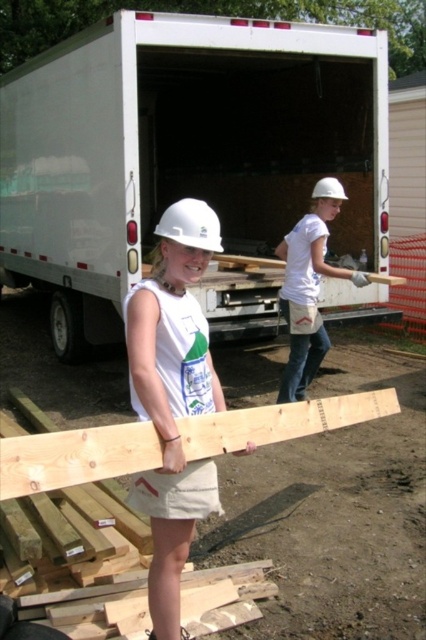
Based on the photo, you are a safety inspector standing at the white matte hard hat at center. You need to reach the white matte hard hat at upper center to check the safety equipment. Can you walk directly to it without needing to climb any obstacles?

The distance between the white matte hard hat at center and the white matte hard hat at upper center is 2.99 meters. Since there are no mentioned obstacles in the scene description, you can walk directly to it.

You are a construction worker standing at the camera position. You need to pick up the natural wood plank at center. Can you reach it without moving your feet?

The natural wood plank at center is 1.97 meters from camera, so yes, you can reach it without moving your feet as it is within arm reach.

You are a construction worker who needs to load a wooden plank onto the white matte truck at center. However, you notice the white matte hard hat at center is placed on top of the truck. Will the wooden plank fit inside the truck if the hard hat is in that position?

The white matte truck at center is not as tall as the white matte hard hat at center, so the hard hat is taller than the truck. Since the hard hat is placed on top of the truck, it might extend beyond the truck bed, leaving enough space for the wooden plank to fit inside.